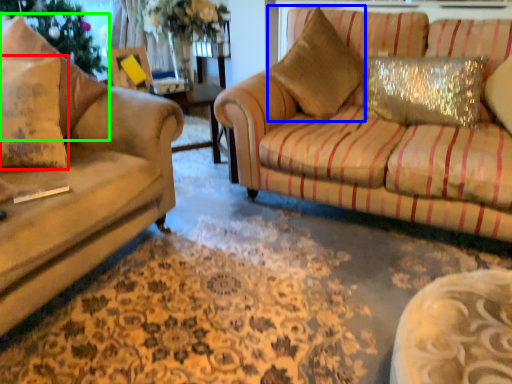
Question: Which object is the closest to the pillow (highlighted by a red box)? Choose among these: throw pillow (highlighted by a blue box) or pillow (highlighted by a green box).

Choices:
 (A) throw pillow
 (B) pillow

Answer: (B)